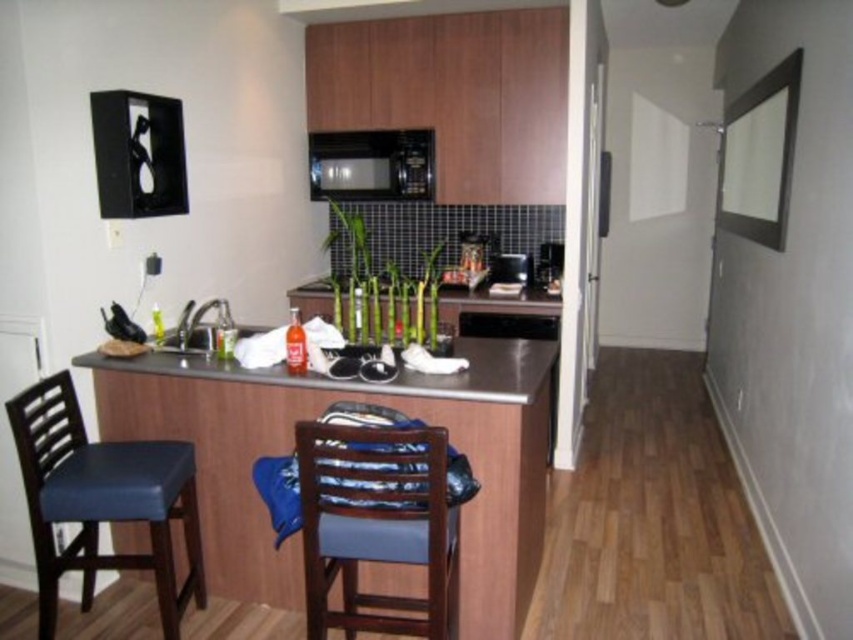
Between wooden chair with blue cushion at center and stainless steel counter at center, which one appears on the right side from the viewer's perspective?

wooden chair with blue cushion at center

The width and height of the screenshot is (853, 640). Identify the location of wooden chair with blue cushion at center. (376, 525).

Does stainless steel counter at center appear on the right side of matte stainless steel sink at center?

Yes, stainless steel counter at center is to the right of matte stainless steel sink at center.

How distant is stainless steel counter at center from matte stainless steel sink at center?

A distance of 36.20 centimeters exists between stainless steel counter at center and matte stainless steel sink at center.

Does point (184, 356) lie behind point (202, 310)?

No.

The image size is (853, 640). I want to click on stainless steel counter at center, so click(369, 381).

Does blue leather chair at left have a greater height compared to stainless steel counter at center?

Correct, blue leather chair at left is much taller as stainless steel counter at center.

Is blue leather chair at left wider than stainless steel counter at center?

In fact, blue leather chair at left might be narrower than stainless steel counter at center.

Is point (170, 588) positioned after point (178, 376)?

No, it is in front of (178, 376).

Find the location of `blue leather chair at left`. blue leather chair at left is located at coordinates (102, 500).